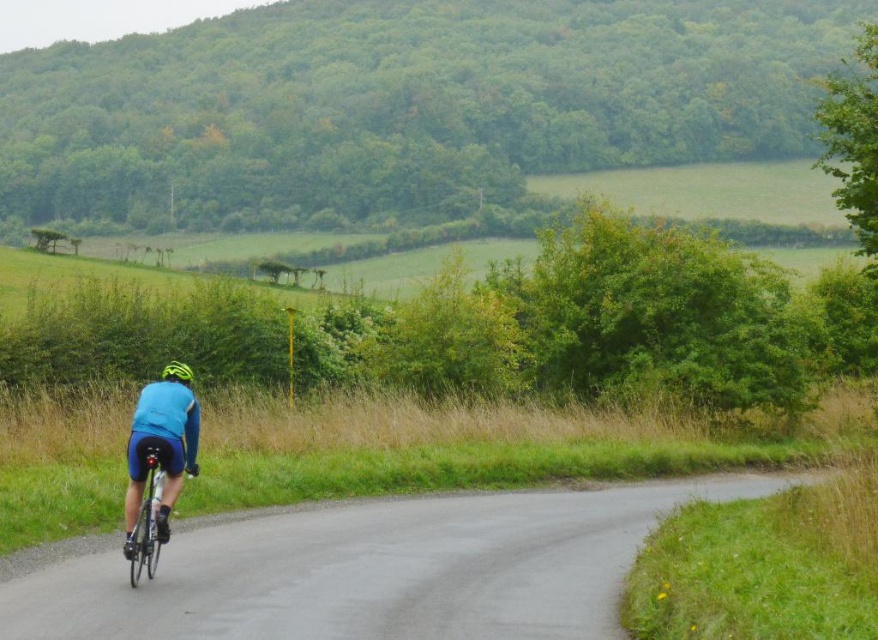
Question: Can you confirm if green leafy hill at upper center is thinner than shiny metallic bicycle at center?

Choices:
 (A) no
 (B) yes

Answer: (A)

Question: Does blue fabric cyclist at center have a greater width compared to green matte helmet at center?

Choices:
 (A) no
 (B) yes

Answer: (A)

Question: Based on their relative distances, which object is nearer to the green leafy hill at upper center?

Choices:
 (A) blue fabric cyclist at center
 (B) green matte helmet at center

Answer: (B)

Question: Based on their relative distances, which object is nearer to the blue fabric cyclist at center?

Choices:
 (A) green matte helmet at center
 (B) green leafy hill at upper center

Answer: (A)

Question: Based on their relative distances, which object is farther from the blue fabric cyclist at center?

Choices:
 (A) green matte helmet at center
 (B) shiny metallic bicycle at center

Answer: (A)

Question: Is green leafy hill at upper center smaller than shiny metallic bicycle at center?

Choices:
 (A) yes
 (B) no

Answer: (B)